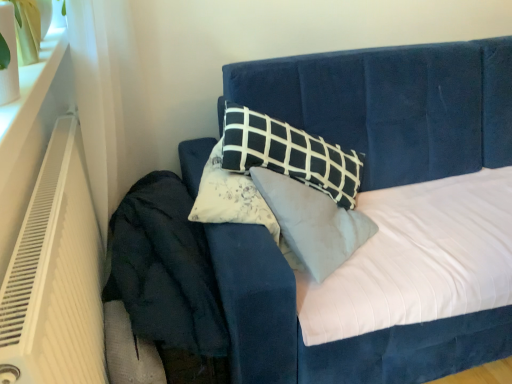
Question: From the image's perspective, is velvet blue bed at center positioned above or below white plastic heater at left?

Choices:
 (A) above
 (B) below

Answer: (A)

Question: From a real-world perspective, relative to white plastic heater at left, is velvet blue bed at center vertically above or below?

Choices:
 (A) below
 (B) above

Answer: (A)

Question: Estimate the real-world distances between objects in this image. Which object is farther from the white plastic heater at left?

Choices:
 (A) dark blue velvet at lower left
 (B) velvet blue bed at center

Answer: (B)

Question: Estimate the real-world distances between objects in this image. Which object is closer to the white plastic heater at left?

Choices:
 (A) velvet blue bed at center
 (B) dark blue velvet at lower left

Answer: (B)